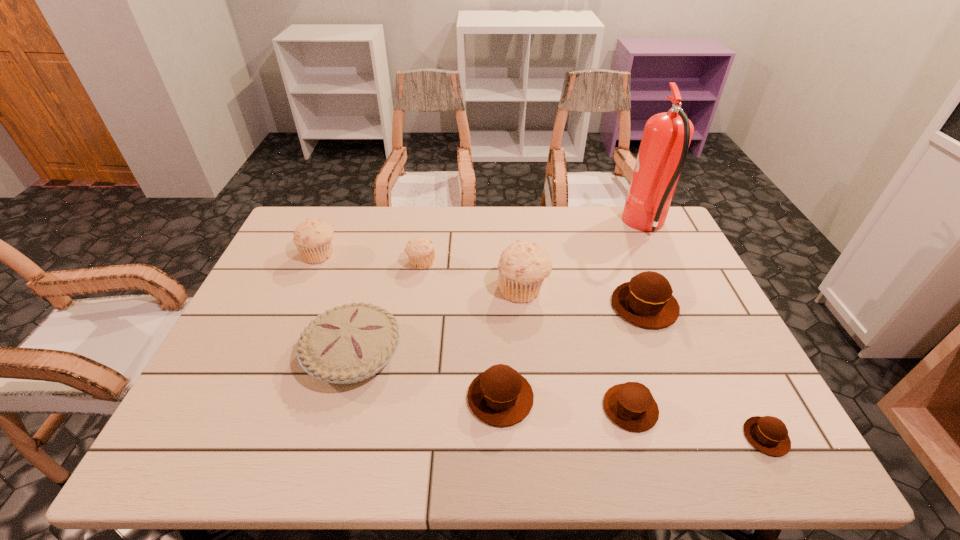
In order to click on muffin that is the fourth closest to the second beige muffin from right to left in this screenshot , I will do `click(646, 301)`.

Identify which beige muffin is located as the second nearest to the eighth shortest object. Please provide its 2D coordinates. Your answer should be formatted as a tuple, i.e. [(x, y)], where the tuple contains the x and y coordinates of a point satisfying the conditions above.

[(313, 238)]

Point out which beige muffin is positioned as the third nearest to the pie. Please provide its 2D coordinates. Your answer should be formatted as a tuple, i.e. [(x, y)], where the tuple contains the x and y coordinates of a point satisfying the conditions above.

[(522, 267)]

Point out which brown muffin is positioned as the nearest to the leftmost object. Please provide its 2D coordinates. Your answer should be formatted as a tuple, i.e. [(x, y)], where the tuple contains the x and y coordinates of a point satisfying the conditions above.

[(500, 396)]

Locate an element on the screen. brown muffin that is the third closest one to the second smallest brown muffin is located at coordinates (646, 301).

The image size is (960, 540). Identify the location of free space that satisfies the following two spatial constraints: 1. on the front side of the second beige muffin from right to left; 2. on the left side of the farthest brown muffin. (415, 306).

Find the location of `free space that satisfies the following two spatial constraints: 1. on the front side of the smallest beige muffin; 2. on the right side of the tallest muffin`. free space that satisfies the following two spatial constraints: 1. on the front side of the smallest beige muffin; 2. on the right side of the tallest muffin is located at coordinates pyautogui.click(x=417, y=289).

Locate an element on the screen. This screenshot has width=960, height=540. free location that satisfies the following two spatial constraints: 1. towards the nozzle of the tallest object; 2. on the front side of the farthest brown muffin is located at coordinates tap(684, 306).

Where is `free spot that satisfies the following two spatial constraints: 1. towards the nozzle of the tallest object; 2. on the front side of the pie`? This screenshot has height=540, width=960. free spot that satisfies the following two spatial constraints: 1. towards the nozzle of the tallest object; 2. on the front side of the pie is located at coordinates (707, 354).

You are a GUI agent. You are given a task and a screenshot of the screen. Output one action in this format:
    pyautogui.click(x=<x>, y=<y>)
    Task: Click on the blank area in the image that satisfies the following two spatial constraints: 1. on the front side of the shortest object; 2. on the right side of the second beige muffin from right to left
    Image resolution: width=960 pixels, height=540 pixels.
    Given the screenshot: What is the action you would take?
    pyautogui.click(x=395, y=437)